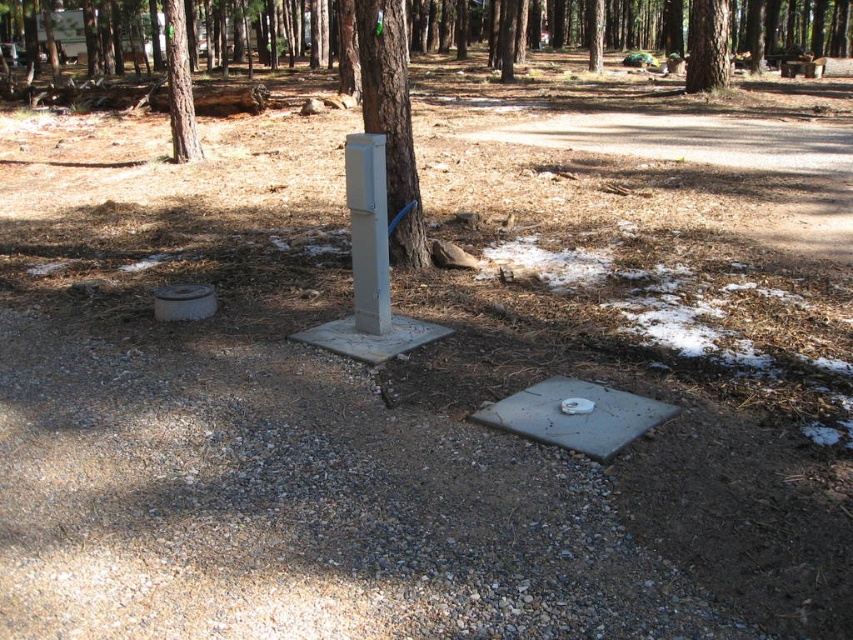
Question: Which object is positioned farthest from the gray matte utility box at center?

Choices:
 (A) brown textured tree at upper center
 (B) brown rough tree at upper left

Answer: (A)

Question: In this image, where is gray metallic utility box at center located relative to brown textured tree at upper center?

Choices:
 (A) below
 (B) above

Answer: (A)

Question: Among these points, which one is nearest to the camera?

Choices:
 (A) (685, 58)
 (B) (363, 19)

Answer: (B)

Question: From the image, what is the correct spatial relationship of brown rough tree at upper left in relation to brown textured tree at upper center?

Choices:
 (A) right
 (B) left

Answer: (B)

Question: Which object is closer to the camera taking this photo?

Choices:
 (A) brown textured tree at upper center
 (B) brown rough tree at upper left
 (C) gray matte utility box at center
 (D) gray metallic utility box at center

Answer: (C)

Question: Where is brown rough tree at upper left located in relation to brown textured tree at upper center in the image?

Choices:
 (A) below
 (B) above

Answer: (A)